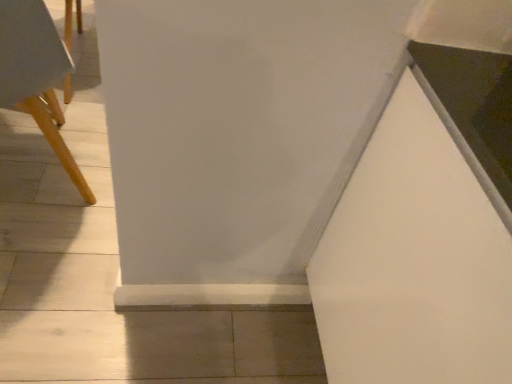
The height and width of the screenshot is (384, 512). I want to click on wooden chair at left, so click(x=36, y=75).

The width and height of the screenshot is (512, 384). What do you see at coordinates (36, 75) in the screenshot?
I see `wooden chair at left` at bounding box center [36, 75].

Locate an element on the screen. Image resolution: width=512 pixels, height=384 pixels. wooden chair at left is located at coordinates (36, 75).